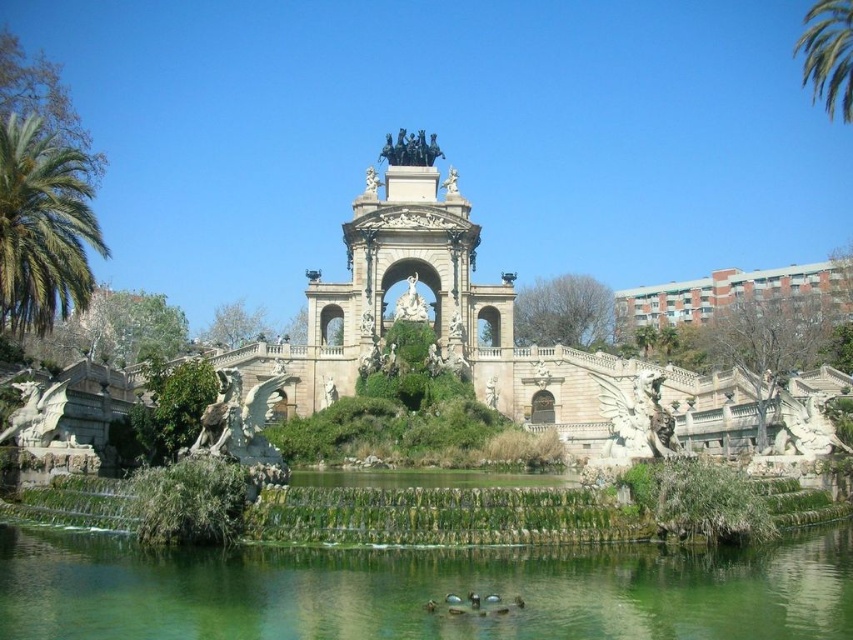
Does white stone palace at center appear on the left side of green leafy palm tree at left?

No, white stone palace at center is not to the left of green leafy palm tree at left.

Between point (306, 340) and point (76, 218), which one is positioned in front?

Point (76, 218) is in front.

I want to click on white stone palace at center, so click(x=425, y=308).

Is green water at center to the right of white stone palace at center from the viewer's perspective?

In fact, green water at center is to the left of white stone palace at center.

Who is higher up, green water at center or white stone palace at center?

white stone palace at center is above.

Is point (50, 609) more distant than point (434, 310)?

No, (50, 609) is in front of (434, 310).

Find the location of a particular element. green water at center is located at coordinates (421, 592).

From the picture: Is green water at center shorter than green leafy palm tree at left?

Yes, green water at center is shorter than green leafy palm tree at left.

Which is more to the right, green water at center or green leafy palm tree at left?

Positioned to the right is green water at center.

You are a GUI agent. You are given a task and a screenshot of the screen. Output one action in this format:
    pyautogui.click(x=<x>, y=<y>)
    Task: Click on the green water at center
    The image size is (853, 640).
    Given the screenshot: What is the action you would take?
    pyautogui.click(x=421, y=592)

Identify the location of green water at center. (421, 592).